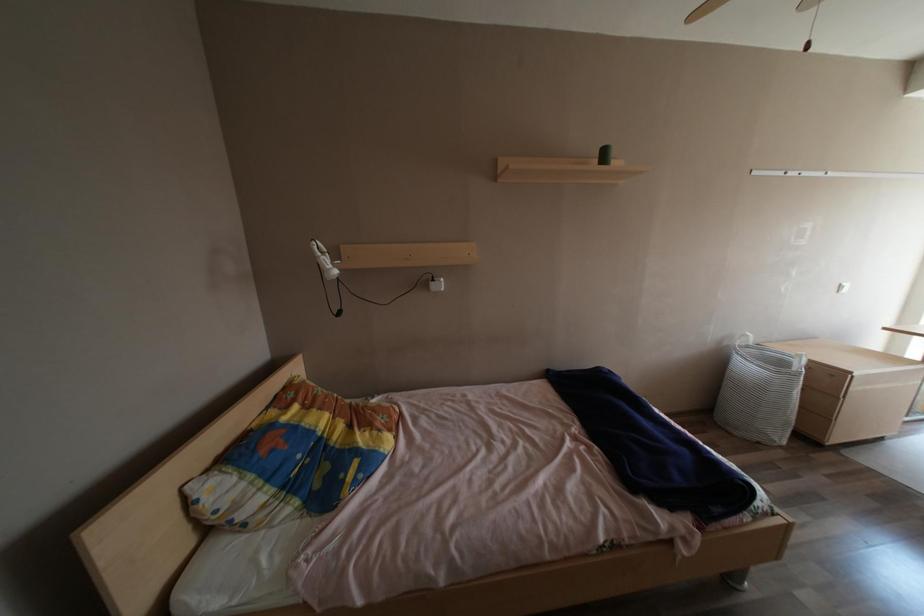
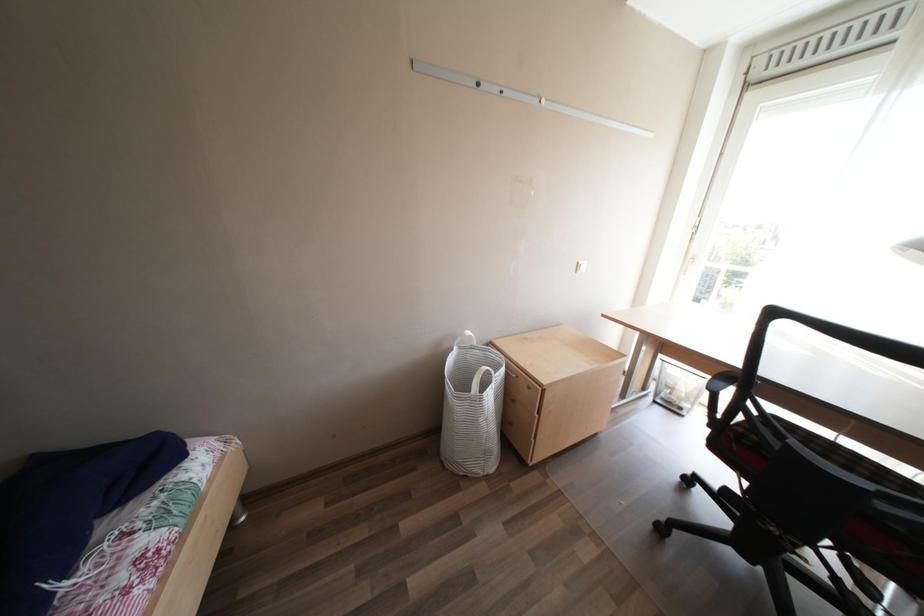
Question: In a continuous first-person perspective shot, in which direction is the camera moving?

Choices:
 (A) Left
 (B) Right
 (C) Forward
 (D) Backward

Answer: (B)